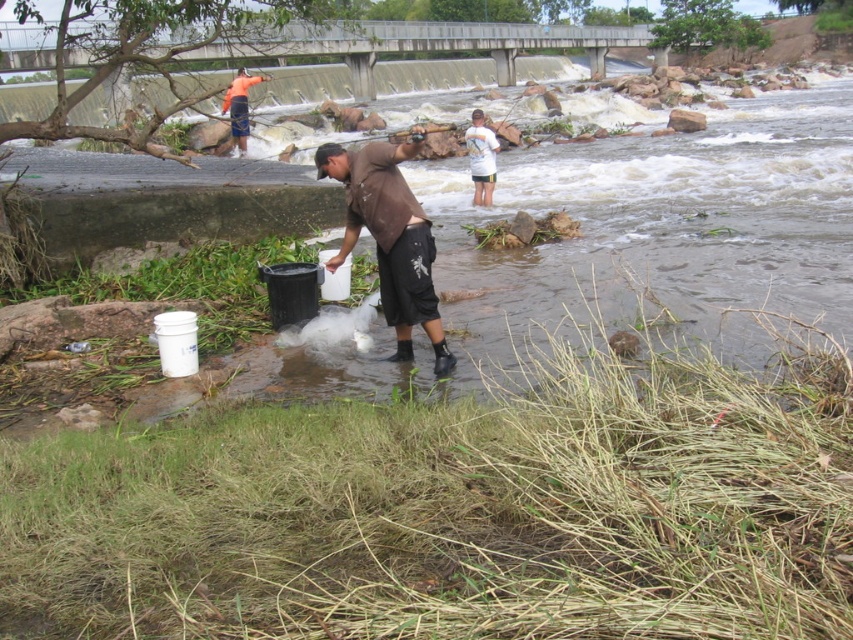
Question: Is white cotton shirt at upper center thinner than orange fabric shirt at upper left?

Choices:
 (A) no
 (B) yes

Answer: (B)

Question: Estimate the real-world distances between objects in this image. Which object is farther from the white cotton shirt at upper center?

Choices:
 (A) orange fabric shirt at upper left
 (B) brown matte shirt at center

Answer: (A)

Question: Which point is farther from the camera taking this photo?

Choices:
 (A) (389, 321)
 (B) (479, 132)
 (C) (238, 122)

Answer: (C)

Question: Does brown matte shirt at center appear on the left side of orange fabric shirt at upper left?

Choices:
 (A) no
 (B) yes

Answer: (A)

Question: Among these objects, which one is farthest from the camera?

Choices:
 (A) white cotton shirt at upper center
 (B) orange fabric shirt at upper left
 (C) brown matte shirt at center

Answer: (B)

Question: Does brown matte shirt at center have a lesser width compared to orange fabric shirt at upper left?

Choices:
 (A) yes
 (B) no

Answer: (A)